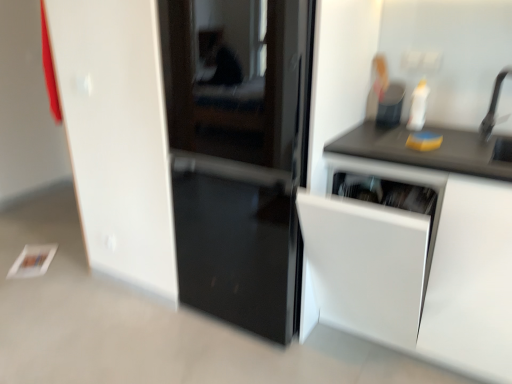
Question: Is glossy black door at center not within black matte faucet at upper right?

Choices:
 (A) no
 (B) yes

Answer: (B)

Question: From a real-world perspective, is glossy black door at center under black matte faucet at upper right?

Choices:
 (A) no
 (B) yes

Answer: (B)

Question: From the image's perspective, does glossy black door at center appear lower than black matte faucet at upper right?

Choices:
 (A) yes
 (B) no

Answer: (A)

Question: Is glossy black door at center behind black matte faucet at upper right?

Choices:
 (A) yes
 (B) no

Answer: (B)

Question: Is glossy black door at center next to black matte faucet at upper right and touching it?

Choices:
 (A) no
 (B) yes

Answer: (A)

Question: From the image's perspective, is black matte faucet at upper right positioned above or below black matte countertop at upper right?

Choices:
 (A) below
 (B) above

Answer: (B)

Question: From a real-world perspective, is black matte faucet at upper right above or below black matte countertop at upper right?

Choices:
 (A) below
 (B) above

Answer: (B)

Question: In the image, is black matte faucet at upper right positioned in front of or behind black matte countertop at upper right?

Choices:
 (A) behind
 (B) front

Answer: (A)

Question: Based on their positions, is black matte faucet at upper right located to the left or right of black matte countertop at upper right?

Choices:
 (A) left
 (B) right

Answer: (B)

Question: Considering their positions, is black matte countertop at upper right located in front of or behind black matte faucet at upper right?

Choices:
 (A) front
 (B) behind

Answer: (A)

Question: Considering the relative positions of black matte countertop at upper right and black matte faucet at upper right in the image provided, is black matte countertop at upper right to the left or to the right of black matte faucet at upper right?

Choices:
 (A) left
 (B) right

Answer: (A)

Question: Which is correct: black matte countertop at upper right is inside black matte faucet at upper right, or outside of it?

Choices:
 (A) outside
 (B) inside

Answer: (A)

Question: Based on their sizes in the image, would you say black matte countertop at upper right is bigger or smaller than black matte faucet at upper right?

Choices:
 (A) small
 (B) big

Answer: (B)

Question: From a real-world perspective, is black matte countertop at upper right above or below white matte cabinet at right?

Choices:
 (A) above
 (B) below

Answer: (A)

Question: Would you say black matte countertop at upper right is to the left or to the right of white matte cabinet at right in the picture?

Choices:
 (A) left
 (B) right

Answer: (B)